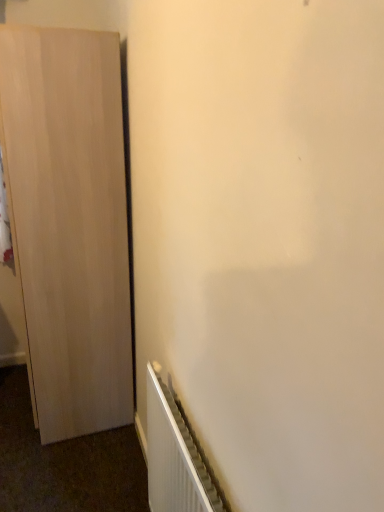
Describe the element at coordinates (174, 457) in the screenshot. I see `white metallic radiator at lower right` at that location.

Measure the distance between white metallic radiator at lower right and camera.

A distance of 37.67 inches exists between white metallic radiator at lower right and camera.

Where is `white metallic radiator at lower right`? This screenshot has width=384, height=512. white metallic radiator at lower right is located at coordinates tap(174, 457).

Based on the photo, measure the distance between point [47,111] and camera.

1.57 meters.

Identify the location of light wood cupboard at left. Image resolution: width=384 pixels, height=512 pixels. point(69,223).

The image size is (384, 512). What do you see at coordinates (69, 223) in the screenshot? I see `light wood cupboard at left` at bounding box center [69, 223].

Identify the location of white metallic radiator at lower right. The width and height of the screenshot is (384, 512). (174, 457).

Does light wood cupboard at left appear on the right side of white metallic radiator at lower right?

Incorrect, light wood cupboard at left is not on the right side of white metallic radiator at lower right.

Is light wood cupboard at left further to camera compared to white metallic radiator at lower right?

Yes, it is.

Does point (130, 410) appear closer or farther from the camera than point (160, 495)?

Point (130, 410).

From the image's perspective, is light wood cupboard at left on white metallic radiator at lower right?

Yes, from the image's perspective, light wood cupboard at left is on top of white metallic radiator at lower right.

From a real-world perspective, is light wood cupboard at left physically below white metallic radiator at lower right?

Actually, light wood cupboard at left is physically above white metallic radiator at lower right in the real world.

In terms of width, does light wood cupboard at left look wider or thinner when compared to white metallic radiator at lower right?

Clearly, light wood cupboard at left has more width compared to white metallic radiator at lower right.

Between light wood cupboard at left and white metallic radiator at lower right, which one has less height?

Standing shorter between the two is white metallic radiator at lower right.

Considering the sizes of light wood cupboard at left and white metallic radiator at lower right in the image, is light wood cupboard at left bigger or smaller than white metallic radiator at lower right?

In the image, light wood cupboard at left appears to be larger than white metallic radiator at lower right.

Would you say light wood cupboard at left is outside white metallic radiator at lower right?

Indeed, light wood cupboard at left is completely outside white metallic radiator at lower right.

Is light wood cupboard at left touching white metallic radiator at lower right?

light wood cupboard at left is not next to white metallic radiator at lower right, and they're not touching.

Is white metallic radiator at lower right at the back of light wood cupboard at left?

No, light wood cupboard at left is not facing the opposite direction of white metallic radiator at lower right.

Looking at this image, how different are the orientations of light wood cupboard at left and white metallic radiator at lower right in degrees?

1.8 degrees.

How far apart are light wood cupboard at left and white metallic radiator at lower right?

light wood cupboard at left is 73.47 centimeters from white metallic radiator at lower right.

Locate an element on the screen. Image resolution: width=384 pixels, height=512 pixels. radiator that is under the light wood cupboard at left (from a real-world perspective) is located at coordinates (174, 457).

Does white metallic radiator at lower right appear on the left side of light wood cupboard at left?

No.

Considering the relative positions of white metallic radiator at lower right and light wood cupboard at left in the image provided, is white metallic radiator at lower right behind light wood cupboard at left?

No, white metallic radiator at lower right is closer to the viewer.

Is point (182, 419) closer to camera compared to point (89, 204)?

Yes, point (182, 419) is closer to viewer.

From the image's perspective, does white metallic radiator at lower right appear higher than light wood cupboard at left?

Incorrect, from the image's perspective, white metallic radiator at lower right is lower than light wood cupboard at left.

From a real-world perspective, is white metallic radiator at lower right on top of light wood cupboard at left?

No, from a real-world perspective, white metallic radiator at lower right is not on top of light wood cupboard at left.

Is white metallic radiator at lower right wider or thinner than light wood cupboard at left?

In the image, white metallic radiator at lower right appears to be more narrow than light wood cupboard at left.

Does white metallic radiator at lower right have a lesser height compared to light wood cupboard at left?

Correct, white metallic radiator at lower right is not as tall as light wood cupboard at left.

Who is smaller, white metallic radiator at lower right or light wood cupboard at left?

white metallic radiator at lower right.

Is white metallic radiator at lower right not within light wood cupboard at left?

Yes.

Are white metallic radiator at lower right and light wood cupboard at left located far from each other?

Actually, white metallic radiator at lower right and light wood cupboard at left are a little close together.

Is white metallic radiator at lower right looking in the opposite direction of light wood cupboard at left?

No, white metallic radiator at lower right is not facing away from light wood cupboard at left.

Can you tell me how much white metallic radiator at lower right and light wood cupboard at left differ in facing direction?

The angular difference between white metallic radiator at lower right and light wood cupboard at left is 1.8 degrees.

Find the location of a particular element. This screenshot has width=384, height=512. cupboard lying behind the white metallic radiator at lower right is located at coordinates (69, 223).

Locate an element on the screen. This screenshot has width=384, height=512. cupboard above the white metallic radiator at lower right (from the image's perspective) is located at coordinates (69, 223).

Where is `cupboard on the left of white metallic radiator at lower right`? cupboard on the left of white metallic radiator at lower right is located at coordinates (69, 223).